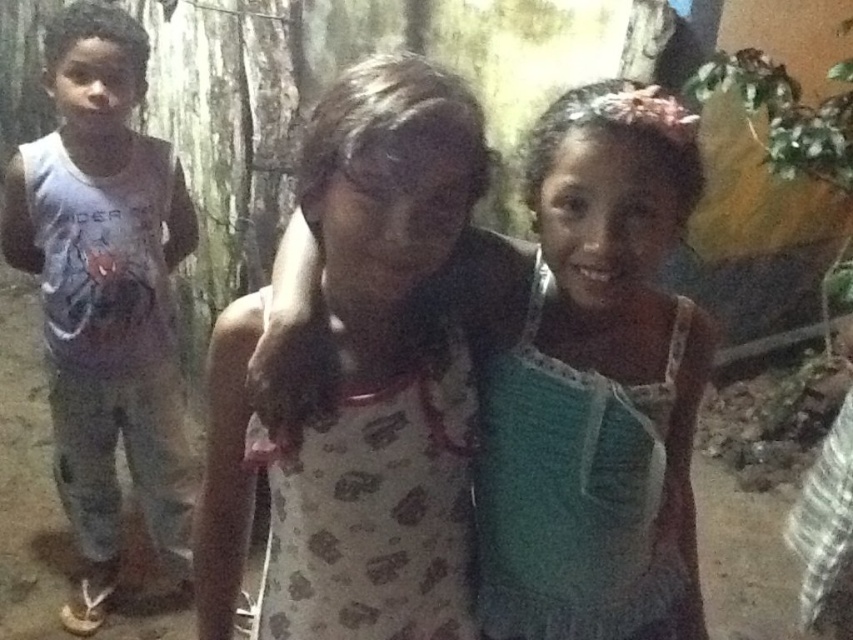
You are trying to decide which outfit to wear for an evening event. You see the printed fabric dress at center and the matte gray tank top at left in the image. Which one is shorter in length?

The printed fabric dress at center is not as tall as the matte gray tank top at left, so the printed fabric dress at center is shorter in length.

You are organizing a clothing sale and need to display the printed fabric dress at center and the matte gray tank top at left. If you have a limited space, which item should you place first to ensure both fit?

The printed fabric dress at center is smaller than the matte gray tank top at left, so you should place the matte gray tank top at left first to accommodate its larger size before arranging the smaller dress.